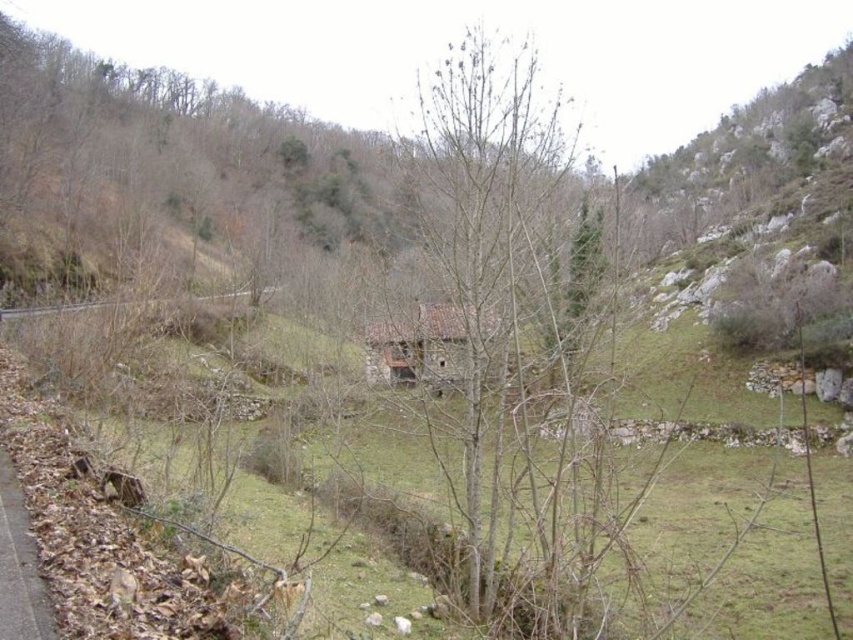
You are standing at the center of the image and want to walk to the brown dirt path at lower left. Which direction should you head towards?

You should head towards the lower left direction to reach the brown dirt path at lower left as it is located at point (19, 566).

Looking at this image, you are a maintenance worker inspecting the tracks. You notice the bare wood at center and the gray concrete train track at center. Which object is positioned higher relative to the other?

The bare wood at center is located above the gray concrete train track at center, so it is positioned higher.